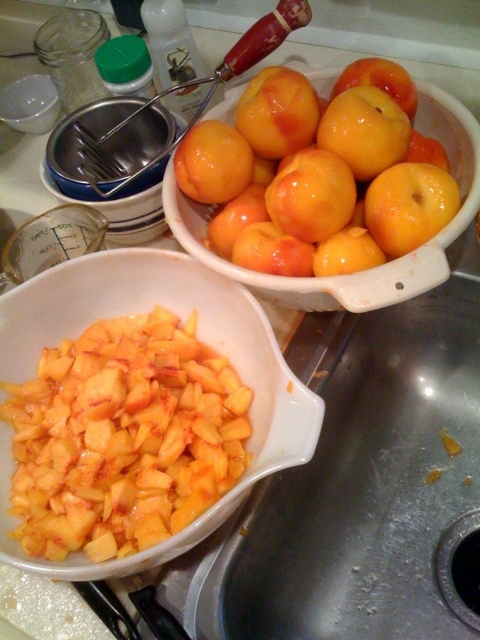
Question: Is glossy yellow-orange fruit at center behind orange matte apple at center?

Choices:
 (A) no
 (B) yes

Answer: (A)

Question: Which object is positioned closest to the glossy yellow-orange fruit at center?

Choices:
 (A) matte yellow-orange fruit at upper center
 (B) yellow matte diced peaches at center
 (C) yellow matte peaches at upper center

Answer: (C)

Question: Which point is farther to the camera?

Choices:
 (A) [x=474, y=180]
 (B) [x=348, y=244]
 (C) [x=31, y=76]
 (D) [x=362, y=68]

Answer: (C)

Question: Is matte yellow-orange fruit at upper center positioned in front of orange matte apple at center?

Choices:
 (A) no
 (B) yes

Answer: (B)

Question: Is yellow matte diced peaches at center behind orange matte apple at center?

Choices:
 (A) no
 (B) yes

Answer: (A)

Question: Which point is closer to the camera?

Choices:
 (A) (32, 132)
 (B) (230, 273)
 (C) (19, 371)

Answer: (B)